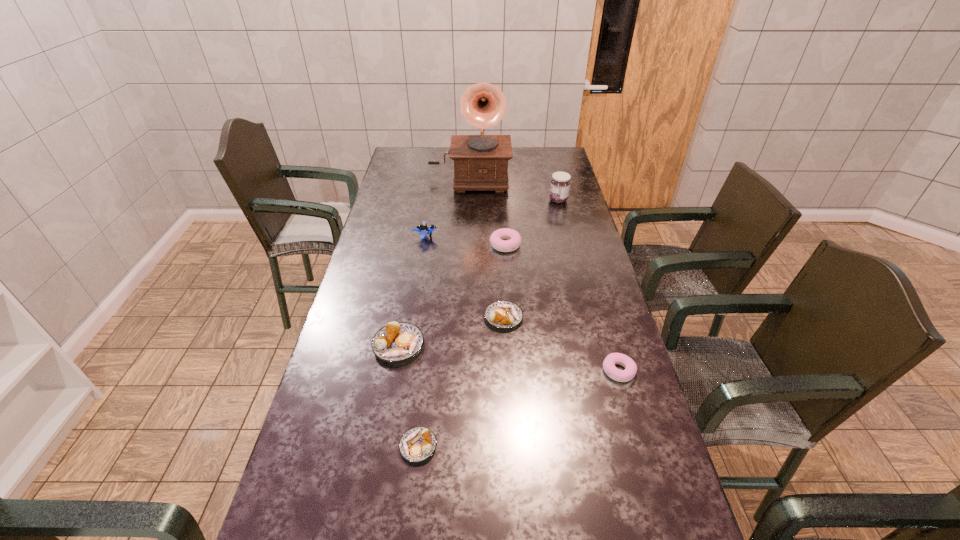
Locate an element on the screen. Image resolution: width=960 pixels, height=540 pixels. free location that satisfies the following two spatial constraints: 1. on the front-facing side of the blue Lego; 2. on the back side of the left pink pastry is located at coordinates click(423, 245).

Find the location of a particular element. The width and height of the screenshot is (960, 540). vacant space that satisfies the following two spatial constraints: 1. on the front-facing side of the blue Lego; 2. on the back side of the nearer pink pastry is located at coordinates (403, 371).